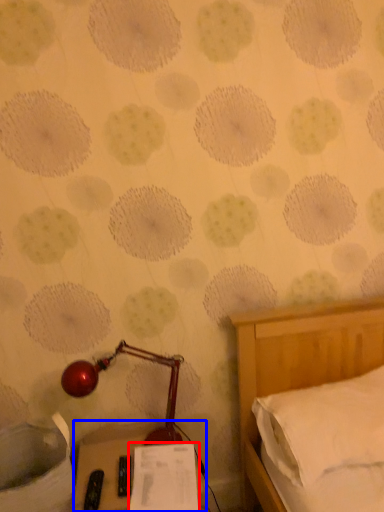
Question: Which point is closer to the camera, paper (highlighted by a red box) or furniture (highlighted by a blue box)?

Choices:
 (A) paper
 (B) furniture

Answer: (B)